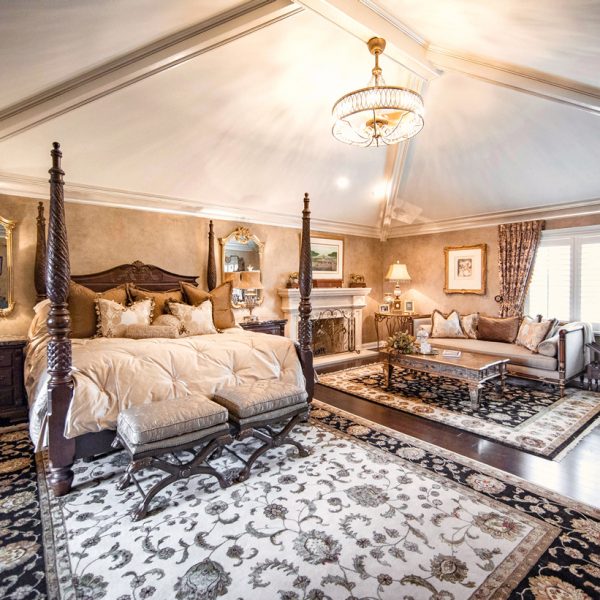
Where is `rug`? rug is located at coordinates (266, 520).